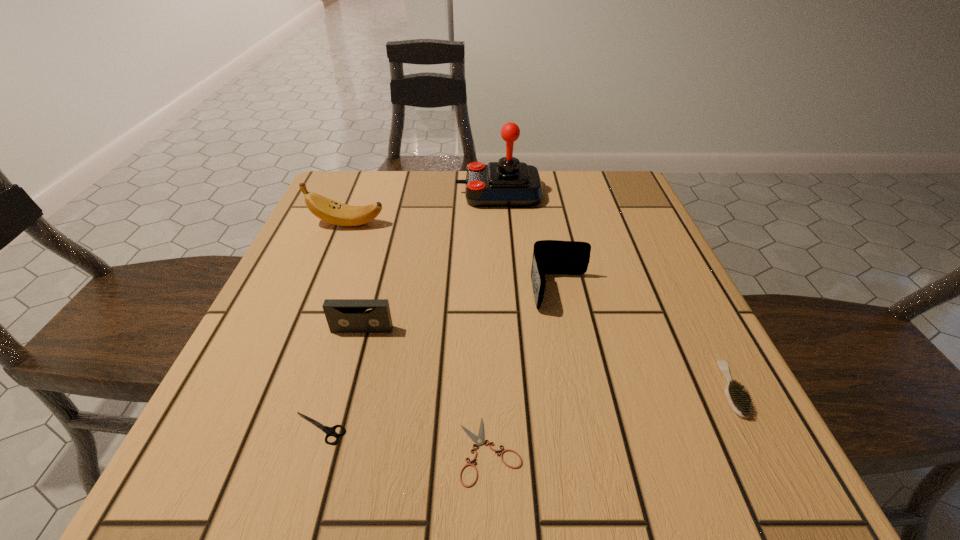
Find the location of `the left shears`. the left shears is located at coordinates (330, 431).

Identify the location of the taller shears. click(x=330, y=431).

Locate an element on the screen. The image size is (960, 540). the shorter shears is located at coordinates (479, 440).

The image size is (960, 540). What are the coordinates of `the shortest object` in the screenshot? It's located at (479, 440).

Where is `vacant space located on the base of the tallest object`? This screenshot has height=540, width=960. vacant space located on the base of the tallest object is located at coordinates (380, 193).

You are a GUI agent. You are given a task and a screenshot of the screen. Output one action in this format:
    pyautogui.click(x=<x>, y=<y>)
    Task: Click on the vacant space situated 0.290m on the base of the tallest object
    Image resolution: width=960 pixels, height=540 pixels.
    Given the screenshot: What is the action you would take?
    click(341, 193)

Locate an element on the screen. vacant space situated 0.320m on the base of the tallest object is located at coordinates (328, 193).

Identify the location of vacant region located 0.320m on the front of the sixth nearest object. This screenshot has width=960, height=540. (300, 341).

You are a GUI agent. You are given a task and a screenshot of the screen. Output one action in this format:
    pyautogui.click(x=<x>, y=<y>)
    Task: Click on the free space located 0.060m on the outer surface of the wallet
    
    Given the screenshot: What is the action you would take?
    pyautogui.click(x=570, y=340)

Image resolution: width=960 pixels, height=540 pixels. I want to click on vacant region located on the front-facing side of the fourth farthest object, so click(318, 494).